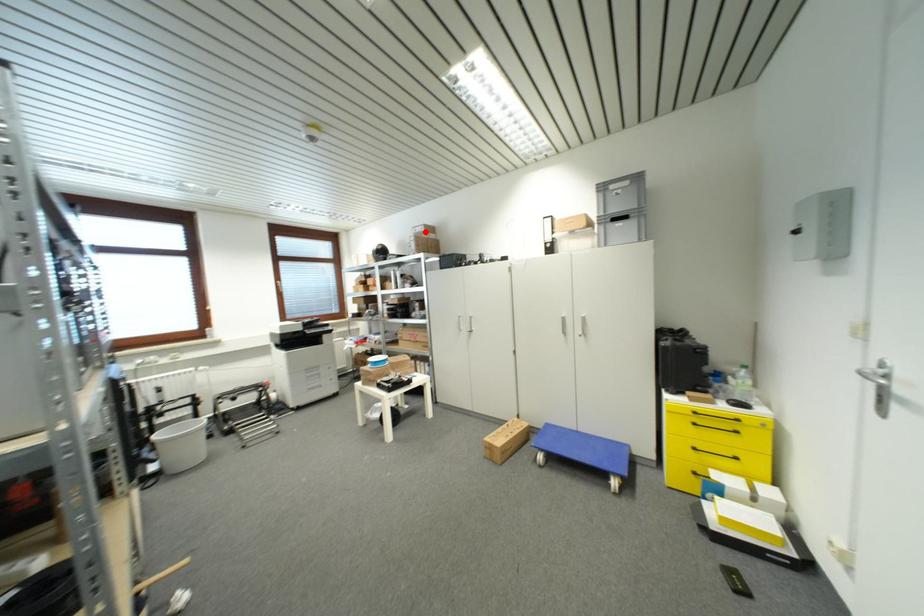
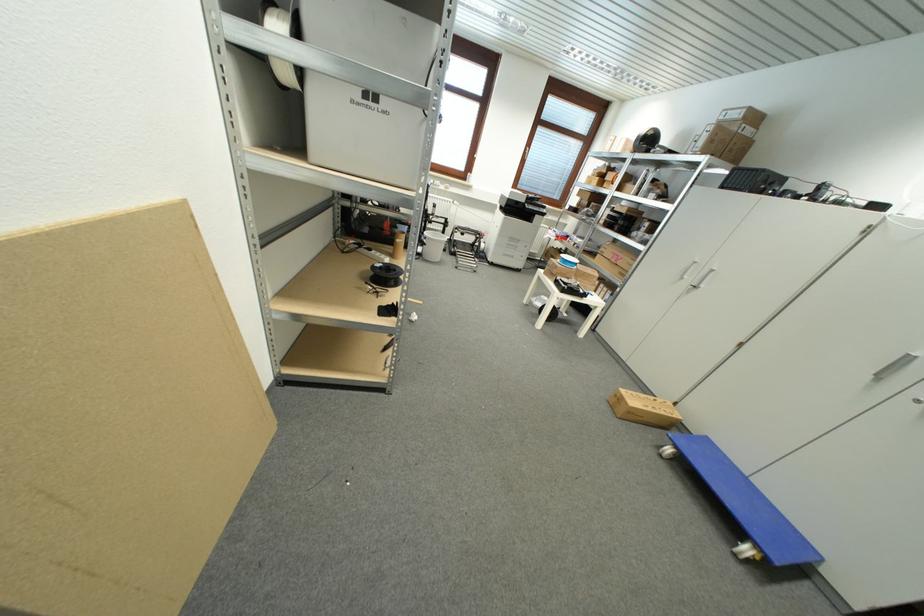
Question: I am providing you with two images of the same scene from different viewpoints. Image1 has a red point marked. In image2, the corresponding 3D location appears at what relative position? Reply with the corresponding letter.

Choices:
 (A) Closer
 (B) Farther

Answer: (B)